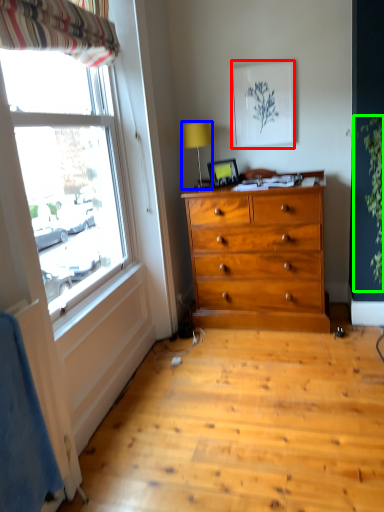
Question: Which is farther away from picture frame (highlighted by a red box)? lamp (highlighted by a blue box) or plant (highlighted by a green box)?

Choices:
 (A) lamp
 (B) plant

Answer: (B)